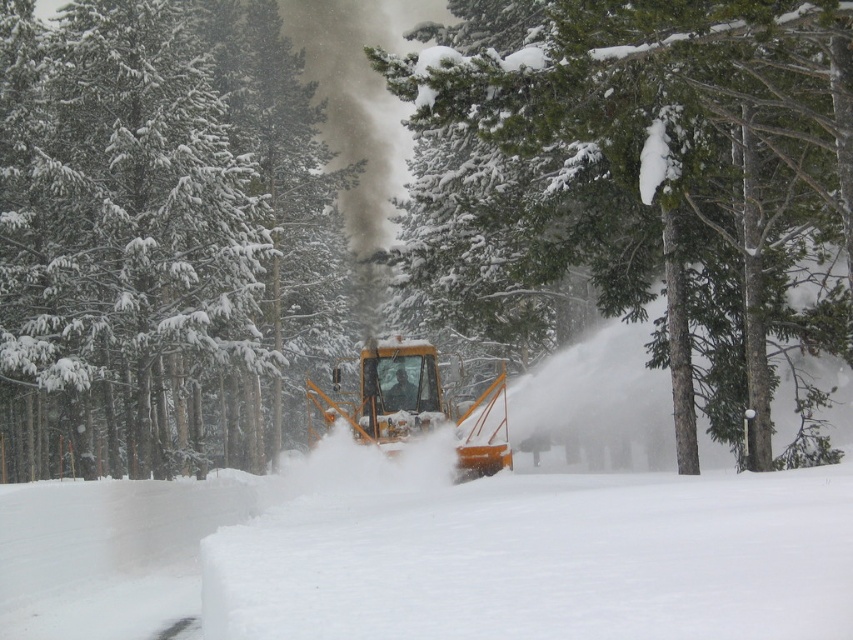
Does snow-covered pine tree at left come behind green textured pine tree at center?

Yes, it is behind green textured pine tree at center.

Identify the location of snow-covered pine tree at left. The image size is (853, 640). 160,236.

Identify the location of snow-covered pine tree at left. The height and width of the screenshot is (640, 853). point(160,236).

Between point (42, 76) and point (373, 442), which one is positioned behind?

The point (42, 76) is behind.

Which of these two, snow-covered pine tree at left or yellow metallic snowplow at center, stands shorter?

yellow metallic snowplow at center is shorter.

Is point (192, 280) less distant than point (438, 426)?

No, (192, 280) is further to viewer.

Identify the location of snow-covered pine tree at left. (160, 236).

Can you confirm if green textured pine tree at center is bigger than yellow metallic snowplow at center?

Yes.

Where is `green textured pine tree at center`? The height and width of the screenshot is (640, 853). green textured pine tree at center is located at coordinates (653, 166).